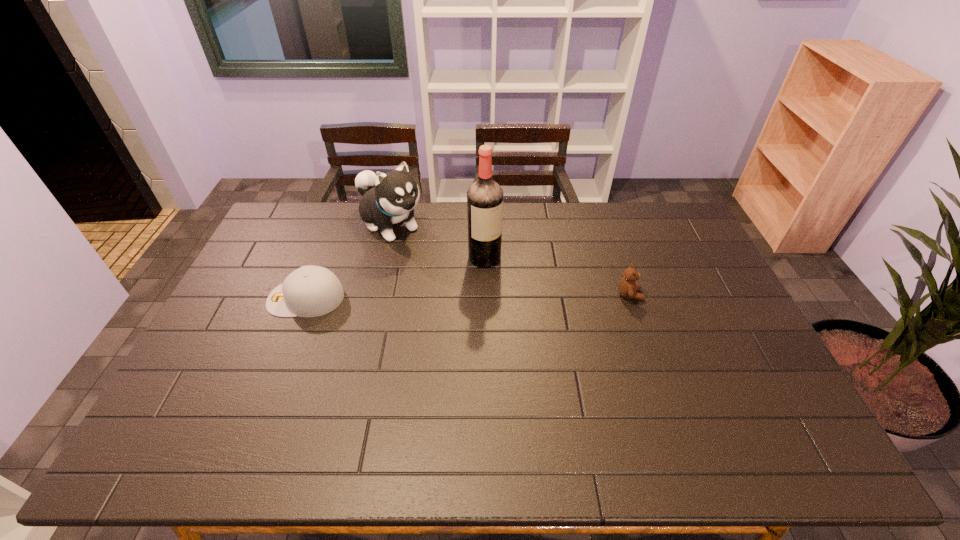
Find the location of `blank region between the cap and the liquor`. blank region between the cap and the liquor is located at coordinates (396, 278).

At what (x,y) coordinates should I click in order to perform the action: click on free space between the shortest object and the teddy bear. Please return your answer as a coordinate pair (x, y). Looking at the image, I should click on (468, 296).

You are a GUI agent. You are given a task and a screenshot of the screen. Output one action in this format:
    pyautogui.click(x=<x>, y=<y>)
    Task: Click on the empty location between the shortest object and the third object from left to right
    
    Given the screenshot: What is the action you would take?
    pyautogui.click(x=396, y=278)

Select which object appears as the second closest to the rightmost object. Please provide its 2D coordinates. Your answer should be formatted as a tuple, i.e. [(x, y)], where the tuple contains the x and y coordinates of a point satisfying the conditions above.

[(389, 198)]

The image size is (960, 540). In order to click on object that can be found as the third closest to the puppy in this screenshot , I will do `click(627, 286)`.

Identify the location of vacant space that satisfies the following two spatial constraints: 1. on the front side of the liquor; 2. at the face of the second shortest object. The width and height of the screenshot is (960, 540). (485, 295).

Locate an element on the screen. The width and height of the screenshot is (960, 540). free space in the image that satisfies the following two spatial constraints: 1. on the front side of the second tallest object; 2. on the left side of the second object from right to left is located at coordinates (382, 258).